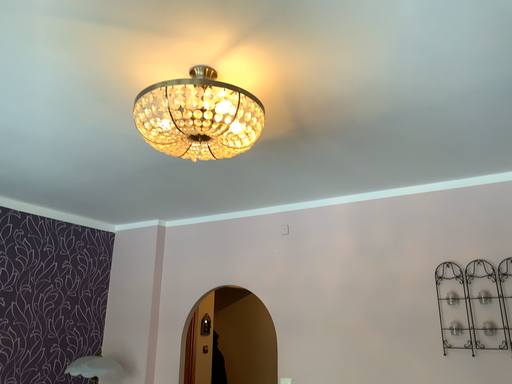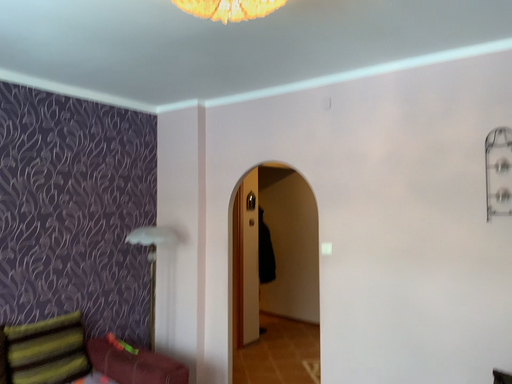
Question: Which way did the camera rotate in the video?

Choices:
 (A) rotated downward
 (B) rotated upward

Answer: (A)